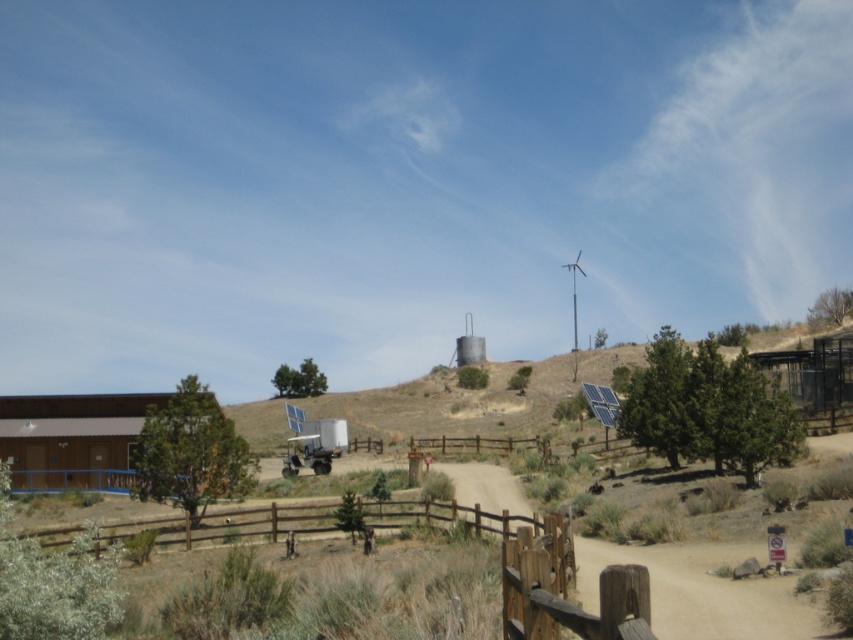
You are a hiker standing at the start of the dirt path bordered by the wooden fence at lower center. You want to reach the white plastic wind turbine at upper center. Based on their heights, which object will you see first when looking straight ahead?

The white plastic wind turbine at upper center will be seen first because it is taller than the wooden fence at lower center.

You are standing at the point marked as point (314, 524) in the image. You want to walk towards the wind turbine in the background. How far will you have to walk to reach the base of the wind turbine?

The distance between you and the wind turbine is 91.00 feet, so you will have to walk 91.00 feet to reach the base of the wind turbine.